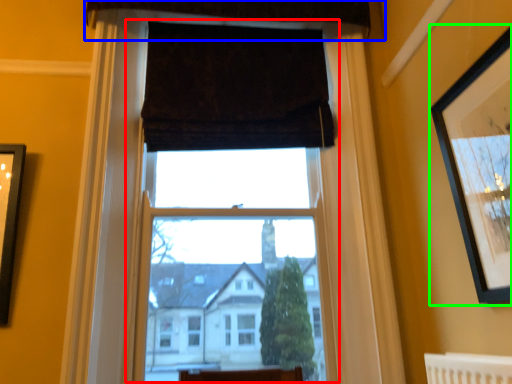
Question: Estimate the real-world distances between objects in this image. Which object is closer to window frame (highlighted by a red box), curtain (highlighted by a blue box) or picture frame (highlighted by a green box)?

Choices:
 (A) curtain
 (B) picture frame

Answer: (B)